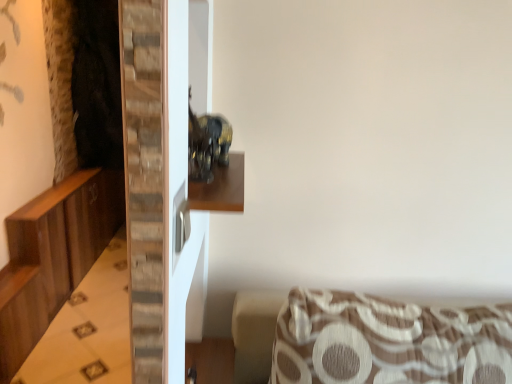
In order to face wooden dresser at left, should I rotate leftwards or rightwards?

Turn left approximately 17.457 degrees to face it.

What are the coordinates of `brown textured cushion at lower right` in the screenshot? It's located at (388, 341).

The width and height of the screenshot is (512, 384). What do you see at coordinates (388, 341) in the screenshot?
I see `brown textured cushion at lower right` at bounding box center [388, 341].

Image resolution: width=512 pixels, height=384 pixels. Describe the element at coordinates (220, 188) in the screenshot. I see `wooden shelf at center` at that location.

Identify the location of wooden dresser at left. (53, 255).

Is wooden dresser at left turned away from brown textured cushion at lower right?

No, wooden dresser at left is not facing away from brown textured cushion at lower right.

Would you say wooden dresser at left contains brown textured cushion at lower right?

No, wooden dresser at left does not contain brown textured cushion at lower right.

Can you tell me how much wooden dresser at left and brown textured cushion at lower right differ in facing direction?

wooden dresser at left and brown textured cushion at lower right are facing 90 degrees away from each other.

Is the surface of wooden dresser at left in direct contact with brown textured cushion at lower right?

No, wooden dresser at left is not in contact with brown textured cushion at lower right.

Is brown textured cushion at lower right positioned with its back to wooden dresser at left?

No, brown textured cushion at lower right is not facing away from wooden dresser at left.

Are brown textured cushion at lower right and wooden dresser at left located far from each other?

Yes, brown textured cushion at lower right and wooden dresser at left are quite far apart.

Considering the positions of objects brown textured cushion at lower right and wooden dresser at left in the image provided, who is more to the left, brown textured cushion at lower right or wooden dresser at left?

Positioned to the left is wooden dresser at left.

Does wooden shelf at center have a lesser width compared to wooden dresser at left?

Yes.

How distant is wooden shelf at center from wooden dresser at left?

wooden shelf at center and wooden dresser at left are 6.02 feet apart from each other.

Does wooden shelf at center have a smaller size compared to wooden dresser at left?

Indeed, wooden shelf at center has a smaller size compared to wooden dresser at left.

Is wooden shelf at center oriented away from wooden dresser at left?

No, wooden dresser at left is not at the back of wooden shelf at center.

Does wooden shelf at center contain brown textured cushion at lower right?

That's incorrect, brown textured cushion at lower right is not inside wooden shelf at center.

Does point (233, 196) come behind point (362, 303)?

No, (233, 196) is in front of (362, 303).

From a real-world perspective, which is physically below, wooden shelf at center or brown textured cushion at lower right?

From a 3D spatial view, brown textured cushion at lower right is below.

Measure the distance from wooden shelf at center to brown textured cushion at lower right.

They are 23.95 inches apart.

Consider the image. Is wooden dresser at left aimed at wooden shelf at center?

No, wooden dresser at left is not turned towards wooden shelf at center.

From a real-world perspective, which object stands above the other?

In real-world perspective, wooden shelf at center is above.

In order to click on dresser that appears below the wooden shelf at center (from a real-world perspective) in this screenshot , I will do `click(53, 255)`.

Considering the relative sizes of wooden dresser at left and wooden shelf at center in the image provided, is wooden dresser at left thinner than wooden shelf at center?

In fact, wooden dresser at left might be wider than wooden shelf at center.

Considering the positions of objects brown textured cushion at lower right and wooden shelf at center in the image provided, who is more to the right, brown textured cushion at lower right or wooden shelf at center?

brown textured cushion at lower right.

In the scene shown: From the image's perspective, is brown textured cushion at lower right over wooden shelf at center?

No.

Find the location of `furniture below the wooden shelf at center (from the image's perspective)`. furniture below the wooden shelf at center (from the image's perspective) is located at coordinates (388, 341).

Identify the location of dresser on the left of the brown textured cushion at lower right. This screenshot has width=512, height=384. (53, 255).

Where is `furniture above the wooden dresser at left (from the image's perspective)`? The height and width of the screenshot is (384, 512). furniture above the wooden dresser at left (from the image's perspective) is located at coordinates (388, 341).

Looking at the image, which one is located further to wooden shelf at center, brown textured cushion at lower right or wooden dresser at left?

wooden dresser at left.

Estimate the real-world distances between objects in this image. Which object is further from wooden dresser at left, wooden shelf at center or brown textured cushion at lower right?

wooden shelf at center lies further to wooden dresser at left than the other object.

Which object lies nearer to the anchor point wooden shelf at center, wooden dresser at left or brown textured cushion at lower right?

brown textured cushion at lower right lies closer to wooden shelf at center than the other object.

Considering their positions, is wooden shelf at center positioned further to brown textured cushion at lower right than wooden dresser at left?

wooden dresser at left is further to brown textured cushion at lower right.

Which object lies nearer to the anchor point brown textured cushion at lower right, wooden dresser at left or wooden shelf at center?

wooden shelf at center.

When comparing their distances from wooden dresser at left, does brown textured cushion at lower right or wooden shelf at center seem closer?

Among the two, brown textured cushion at lower right is located nearer to wooden dresser at left.

Where is `shelf between wooden dresser at left and brown textured cushion at lower right from left to right`? The height and width of the screenshot is (384, 512). shelf between wooden dresser at left and brown textured cushion at lower right from left to right is located at coordinates (220, 188).